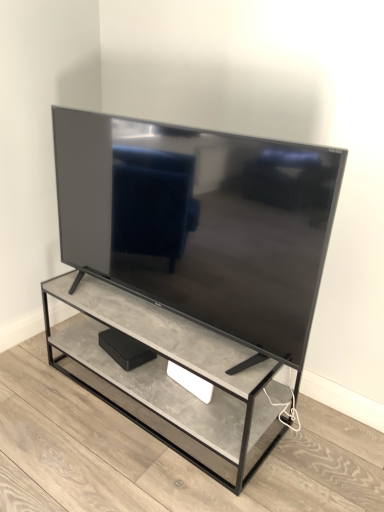
The image size is (384, 512). What are the coordinates of `free space above concrete/metal shelf at center (from a real-world perspective)` in the screenshot? It's located at (157, 436).